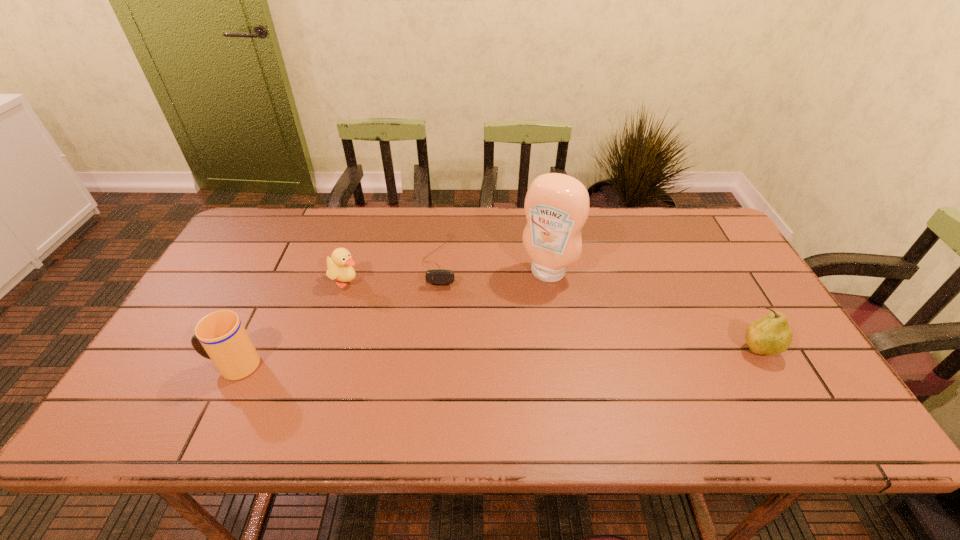
Where is `free space on the desktop that is between the cup and the rightmost object and is positioned on the label of the second object from right to left`? The image size is (960, 540). free space on the desktop that is between the cup and the rightmost object and is positioned on the label of the second object from right to left is located at coordinates (493, 358).

The height and width of the screenshot is (540, 960). What are the coordinates of `free space on the desktop that is between the cup and the rightmost object and is positioned on the front-facing side of the shortest object` in the screenshot? It's located at (424, 360).

The image size is (960, 540). Find the location of `vacant spot on the desktop that is between the leftmost object and the rightmost object and is positioned on the front-facing side of the duckling`. vacant spot on the desktop that is between the leftmost object and the rightmost object and is positioned on the front-facing side of the duckling is located at coordinates (505, 357).